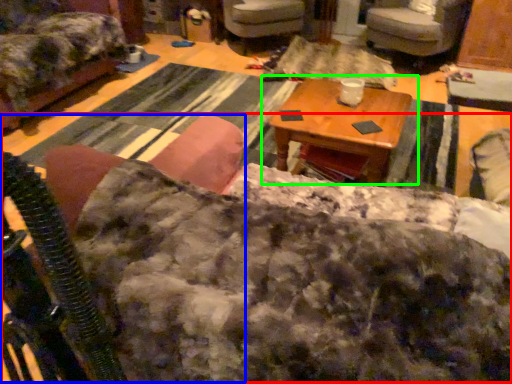
Question: Based on their relative distances, which object is farther from couch (highlighted by a red box)? Choose from rocking chair (highlighted by a blue box) and table (highlighted by a green box).

Choices:
 (A) rocking chair
 (B) table

Answer: (B)